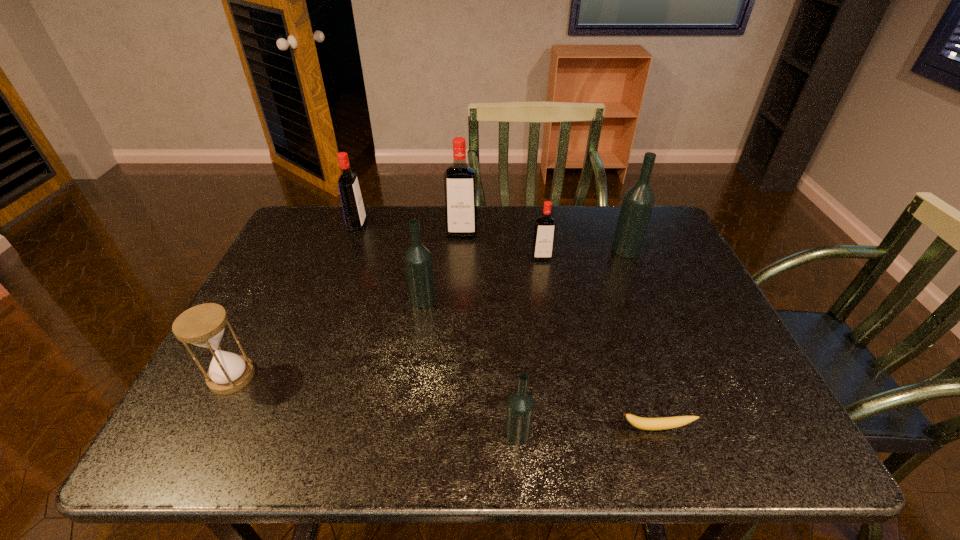
Image resolution: width=960 pixels, height=540 pixels. I want to click on vacant region between the second black vodka from right to left and the second smallest red vodka, so click(x=438, y=329).

The height and width of the screenshot is (540, 960). Identify the location of free point between the farthest black vodka and the rightmost red vodka. (584, 253).

Identify the location of object that is the fourth closest to the fourth object from left to right. (638, 201).

Locate an element on the screen. The image size is (960, 540). the sixth closest object to the banana is located at coordinates (203, 325).

You are a GUI agent. You are given a task and a screenshot of the screen. Output one action in this format:
    pyautogui.click(x=<x>, y=<y>)
    Task: Click on the vodka object that ranks as the second closest to the second black vodka from left to right
    
    Given the screenshot: What is the action you would take?
    pyautogui.click(x=544, y=232)

At what (x,y) coordinates should I click in order to perform the action: click on vodka that is the fourth closest to the nearest red vodka. Please return your answer as a coordinate pair (x, y). The width and height of the screenshot is (960, 540). Looking at the image, I should click on (520, 405).

Identify the location of black vodka that is the closest to the third vodka from right to left. The width and height of the screenshot is (960, 540). (418, 261).

Identify the location of black vodka that is the closest to the third vodka from left to right. (418, 261).

Select which red vodka appears as the second closest to the seventh object from right to left. Please provide its 2D coordinates. Your answer should be formatted as a tuple, i.e. [(x, y)], where the tuple contains the x and y coordinates of a point satisfying the conditions above.

[(544, 232)]

The height and width of the screenshot is (540, 960). I want to click on red vodka that stands as the third closest to the third object from left to right, so click(353, 208).